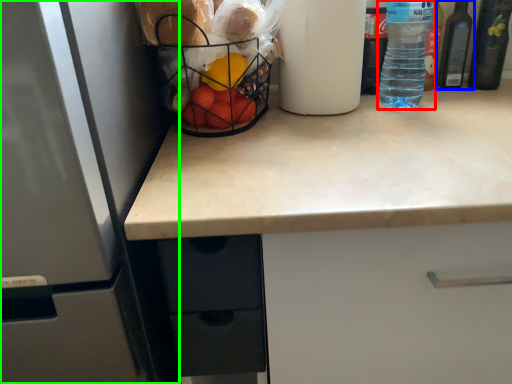
Question: Which object is the closest to the bottle (highlighted by a red box)? Choose among these: bottle (highlighted by a blue box) or refrigerator (highlighted by a green box).

Choices:
 (A) bottle
 (B) refrigerator

Answer: (A)